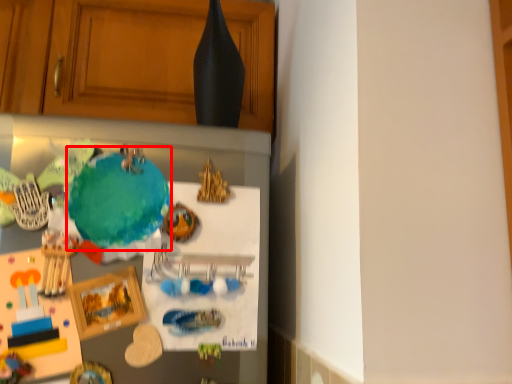
Question: From the image's perspective, where is teal (annotated by the red box) located in relation to cabinetry in the image?

Choices:
 (A) below
 (B) above

Answer: (A)